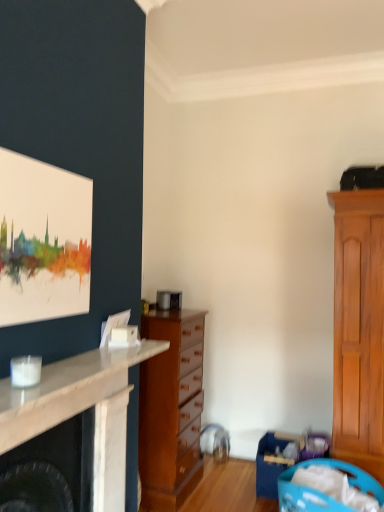
Question: Is blue plastic laundry basket at lower right, placed as the 1th laundry basket when sorted from front to back, closer to the viewer compared to white marble fireplace at left?

Choices:
 (A) yes
 (B) no

Answer: (B)

Question: Is blue plastic laundry basket at lower right, the second laundry basket when ordered from back to front, wider than white marble fireplace at left?

Choices:
 (A) no
 (B) yes

Answer: (B)

Question: Is white marble fireplace at left inside blue plastic laundry basket at lower right, placed as the 1th laundry basket when sorted from front to back?

Choices:
 (A) no
 (B) yes

Answer: (A)

Question: Can you see blue plastic laundry basket at lower right, placed as the 1th laundry basket when sorted from front to back, touching white marble fireplace at left?

Choices:
 (A) yes
 (B) no

Answer: (B)

Question: Does blue plastic laundry basket at lower right, placed as the 1th laundry basket when sorted from front to back, have a greater height compared to white marble fireplace at left?

Choices:
 (A) yes
 (B) no

Answer: (A)

Question: From the image's perspective, relative to blue plastic laundry basket at lower right, the second laundry basket when ordered from back to front, is white marble fireplace at left above or below?

Choices:
 (A) above
 (B) below

Answer: (A)

Question: Relative to blue plastic laundry basket at lower right, placed as the 1th laundry basket when sorted from front to back, is white marble fireplace at left in front or behind?

Choices:
 (A) behind
 (B) front

Answer: (B)

Question: Is white marble fireplace at left taller or shorter than blue plastic laundry basket at lower right, placed as the 1th laundry basket when sorted from front to back?

Choices:
 (A) tall
 (B) short

Answer: (B)

Question: In terms of width, does white marble fireplace at left look wider or thinner when compared to blue plastic laundry basket at lower right, placed as the 1th laundry basket when sorted from front to back?

Choices:
 (A) thin
 (B) wide

Answer: (A)

Question: From a real-world perspective, is blue plastic laundry basket at lower right, the second laundry basket when ordered from back to front, physically located above or below watercolor canvas at upper left?

Choices:
 (A) above
 (B) below

Answer: (B)

Question: Is blue plastic laundry basket at lower right, placed as the 1th laundry basket when sorted from front to back, situated inside watercolor canvas at upper left or outside?

Choices:
 (A) outside
 (B) inside

Answer: (A)

Question: Visually, is blue plastic laundry basket at lower right, placed as the 1th laundry basket when sorted from front to back, positioned to the left or to the right of watercolor canvas at upper left?

Choices:
 (A) right
 (B) left

Answer: (A)

Question: From the image's perspective, is blue plastic laundry basket at lower right, the second laundry basket when ordered from back to front, positioned above or below watercolor canvas at upper left?

Choices:
 (A) above
 (B) below

Answer: (B)

Question: From the image's perspective, is watercolor canvas at upper left positioned above or below blue plastic laundry basket at lower right, the first laundry basket when ordered from back to front?

Choices:
 (A) above
 (B) below

Answer: (A)

Question: Considering the relative positions of watercolor canvas at upper left and blue plastic laundry basket at lower right, the second laundry basket when ordered from front to back, in the image provided, is watercolor canvas at upper left to the left or to the right of blue plastic laundry basket at lower right, the second laundry basket when ordered from front to back,?

Choices:
 (A) right
 (B) left

Answer: (B)